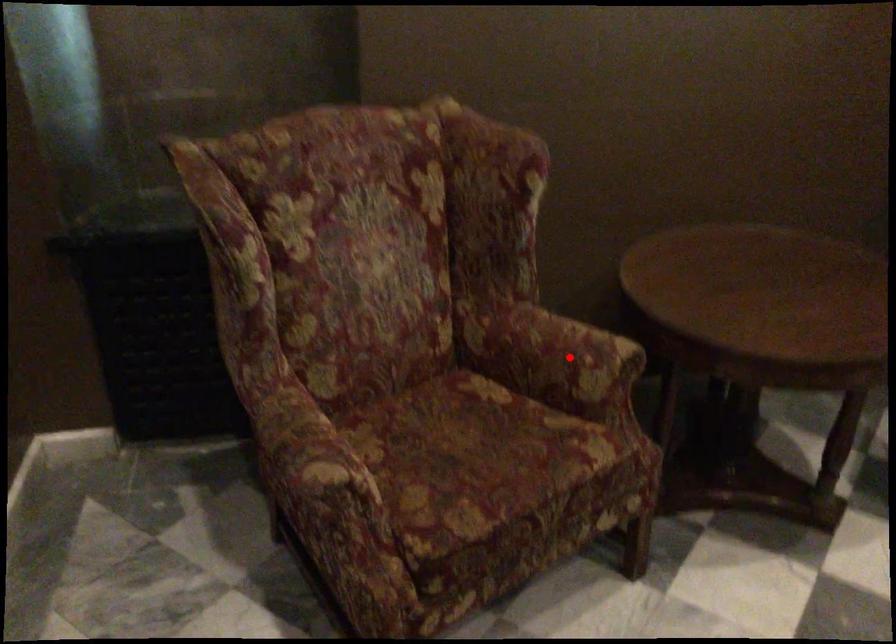
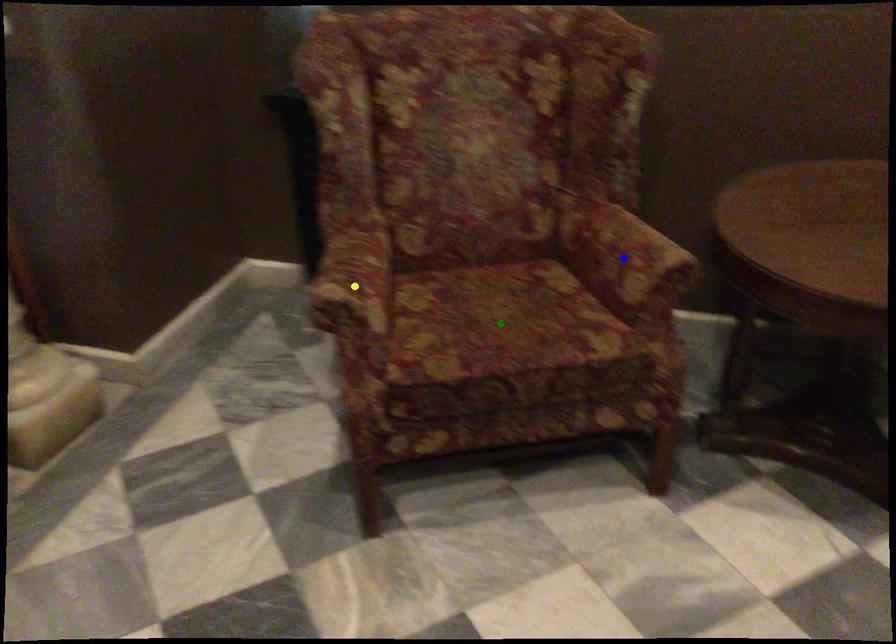
Question: I am providing you with two images of the same scene from different viewpoints. A red point is marked on the first image. You are given multiple points on the second image. Can you choose the point in image 2 that corresponds to the point in image 1?

Choices:
 (A) yellow point
 (B) green point
 (C) blue point

Answer: (C)